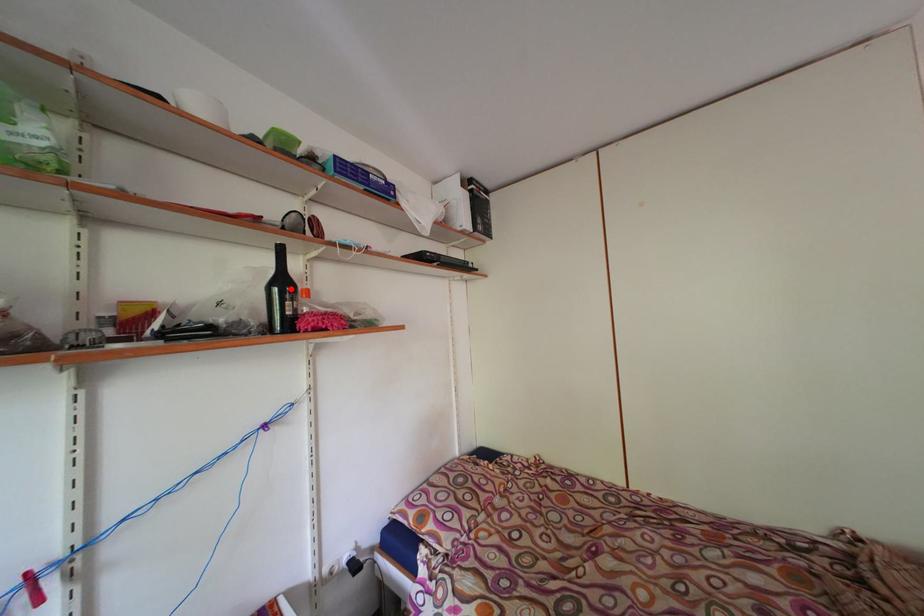
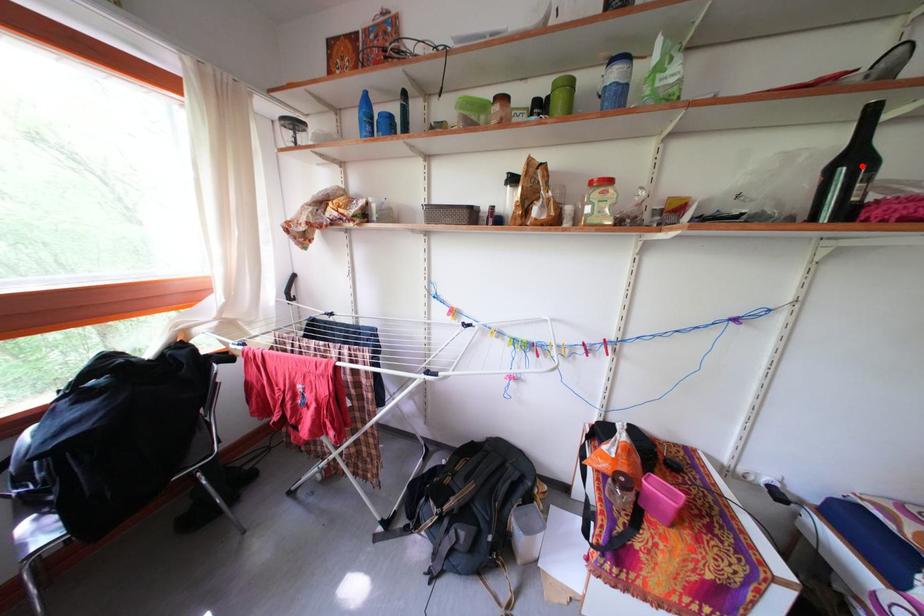
I am providing you with two images of the same scene from different viewpoints. A red point is marked on the first image and another point is marked on the second image. Does the point marked in image1 correspond to the same location as the one in image2?

Yes